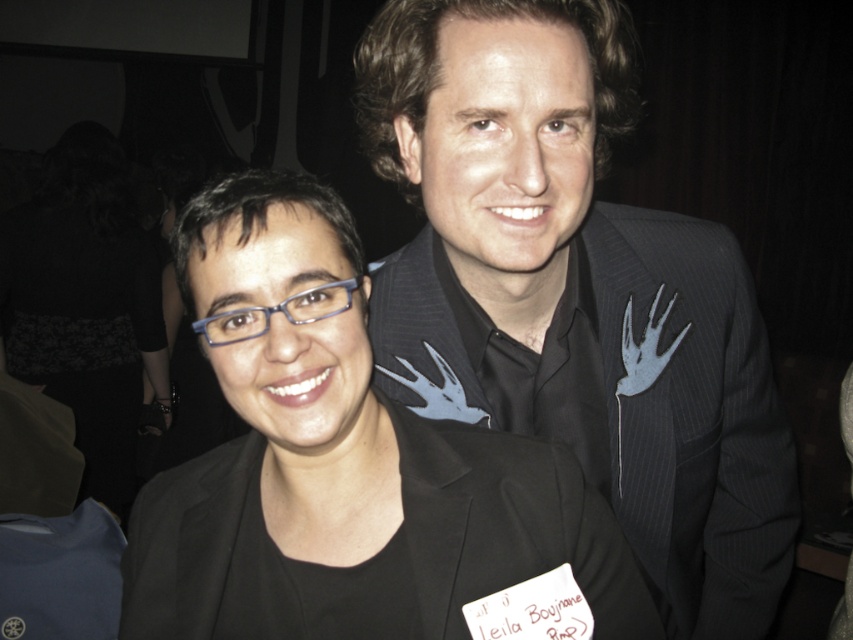
You are a photographer adjusting the camera focus for the two points in the image. Which point is closer to the camera? The points are point (647,227) and point (426,428).

Point (647,227) is further to the viewer than point (426,428), so the closer point to the camera is point (426,428).